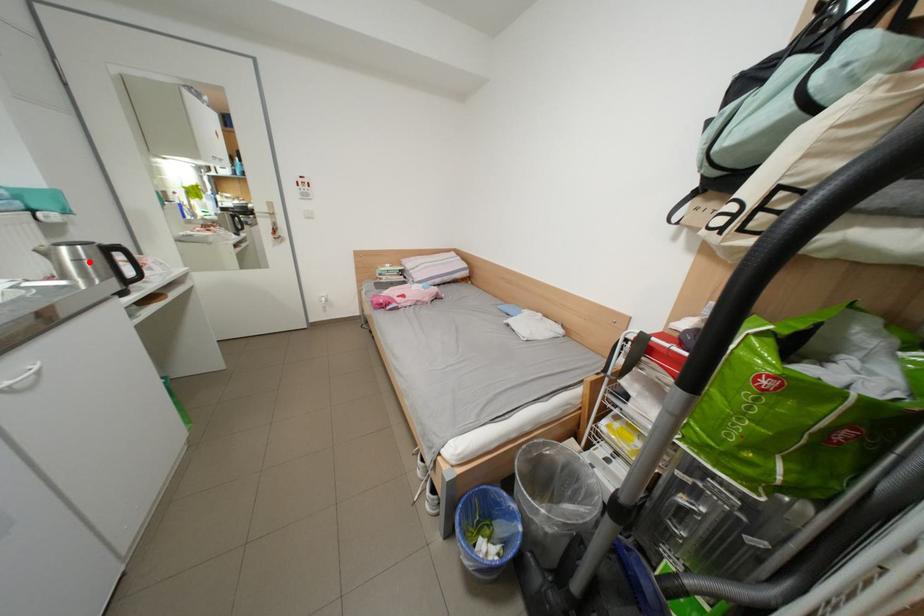
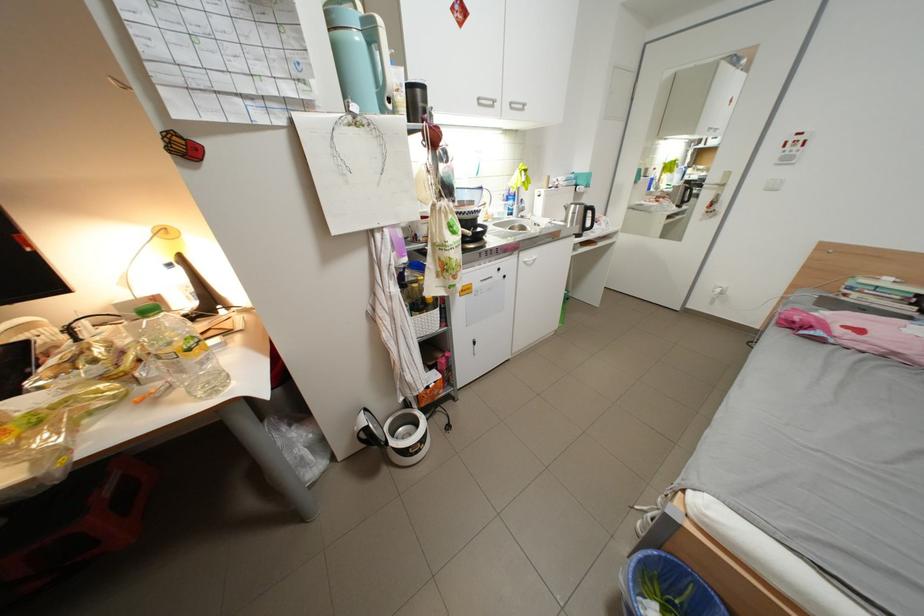
Question: I am providing you with two images of the same scene from different viewpoints. A red point is marked on the first image. At the location where the point appears in image 1, is it still visible in image 2?

Choices:
 (A) Yes
 (B) No

Answer: (A)